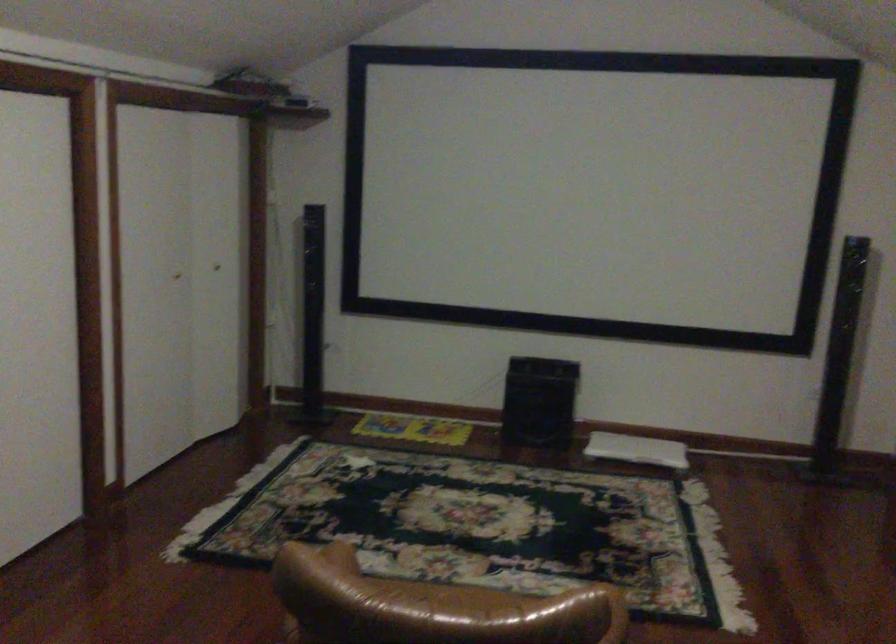
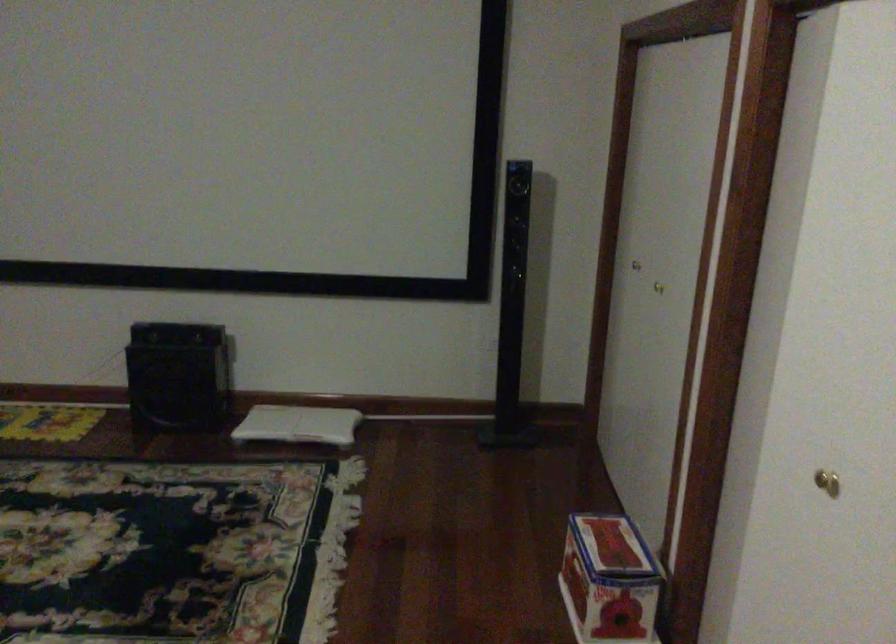
Based on the photo, in a continuous first-person perspective shot, in which direction is the camera moving?

The cameraman moved toward right, forward.